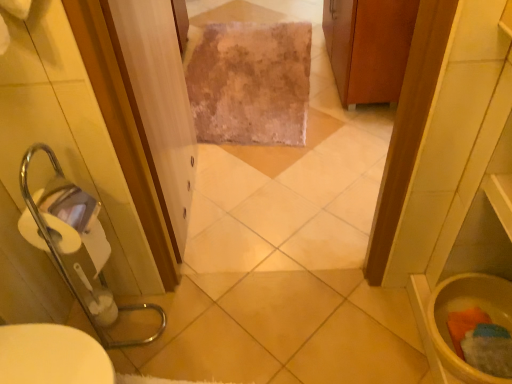
Describe the element at coordinates (464, 309) in the screenshot. I see `yellow matte toilet bowl at lower right` at that location.

Image resolution: width=512 pixels, height=384 pixels. Describe the element at coordinates (369, 47) in the screenshot. I see `wooden cabinet at upper right` at that location.

You are a GUI agent. You are given a task and a screenshot of the screen. Output one action in this format:
    pyautogui.click(x=<x>, y=<y>)
    Task: Click on the wooden cabinet at upper right
    
    Given the screenshot: What is the action you would take?
    pyautogui.click(x=369, y=47)

The width and height of the screenshot is (512, 384). I want to click on yellow matte toilet bowl at lower right, so click(x=464, y=309).

Looking at this image, can you confirm if wooden cabinet at upper right is positioned to the left of yellow matte toilet bowl at lower right?

Yes, wooden cabinet at upper right is to the left of yellow matte toilet bowl at lower right.

Considering the relative sizes of wooden cabinet at upper right and yellow matte toilet bowl at lower right in the image provided, is wooden cabinet at upper right bigger than yellow matte toilet bowl at lower right?

Yes.

Considering the sizes of wooden cabinet at upper right and yellow matte toilet bowl at lower right in the image, is wooden cabinet at upper right wider or thinner than yellow matte toilet bowl at lower right?

wooden cabinet at upper right is wider than yellow matte toilet bowl at lower right.

From the image's perspective, does wooden cabinet at upper right appear higher than yellow matte toilet bowl at lower right?

Yes, from the image's perspective, wooden cabinet at upper right is above yellow matte toilet bowl at lower right.

Considering the relative positions of yellow matte toilet bowl at lower right and clear plastic screen door at center in the image provided, is yellow matte toilet bowl at lower right behind clear plastic screen door at center?

Yes, yellow matte toilet bowl at lower right is further from the camera.

Where is `screen door above the yellow matte toilet bowl at lower right (from the image's perspective)`? This screenshot has height=384, width=512. screen door above the yellow matte toilet bowl at lower right (from the image's perspective) is located at coordinates (157, 102).

From their relative heights in the image, would you say yellow matte toilet bowl at lower right is taller or shorter than clear plastic screen door at center?

yellow matte toilet bowl at lower right is shorter than clear plastic screen door at center.

How much distance is there between yellow matte toilet bowl at lower right and clear plastic screen door at center?

3.60 feet.

Considering the sizes of fuzzy beige rug at center and clear plastic screen door at center in the image, is fuzzy beige rug at center bigger or smaller than clear plastic screen door at center?

Considering their sizes, fuzzy beige rug at center takes up less space than clear plastic screen door at center.

Considering the sizes of objects fuzzy beige rug at center and clear plastic screen door at center in the image provided, who is wider, fuzzy beige rug at center or clear plastic screen door at center?

fuzzy beige rug at center.

In the scene shown: Would you consider fuzzy beige rug at center to be distant from clear plastic screen door at center?

Actually, fuzzy beige rug at center and clear plastic screen door at center are a little close together.

From the image's perspective, is fuzzy beige rug at center below clear plastic screen door at center?

No, from the image's perspective, fuzzy beige rug at center is not beneath clear plastic screen door at center.

From the image's perspective, which one is positioned lower, clear plastic screen door at center or yellow matte toilet bowl at lower right?

yellow matte toilet bowl at lower right.

Is clear plastic screen door at center positioned beyond the bounds of yellow matte toilet bowl at lower right?

clear plastic screen door at center is positioned outside yellow matte toilet bowl at lower right.

The height and width of the screenshot is (384, 512). In order to click on toilet bowl that is below the clear plastic screen door at center (from the image's perspective) in this screenshot , I will do point(464,309).

Considering the sizes of objects clear plastic screen door at center and yellow matte toilet bowl at lower right in the image provided, who is smaller, clear plastic screen door at center or yellow matte toilet bowl at lower right?

With smaller size is yellow matte toilet bowl at lower right.

I want to click on bath towel behind the wooden cabinet at upper right, so click(251, 83).

Based on the photo, can you confirm if wooden cabinet at upper right is taller than fuzzy beige rug at center?

Indeed, wooden cabinet at upper right has a greater height compared to fuzzy beige rug at center.

Is wooden cabinet at upper right positioned far away from fuzzy beige rug at center?

No, wooden cabinet at upper right is in close proximity to fuzzy beige rug at center.

Which is more to the right, wooden cabinet at upper right or clear plastic screen door at center?

wooden cabinet at upper right is more to the right.

Find the location of a particular element. This screenshot has width=512, height=384. cabinetry that is behind the clear plastic screen door at center is located at coordinates (369, 47).

Is wooden cabinet at upper right facing towards clear plastic screen door at center?

No, wooden cabinet at upper right is not facing towards clear plastic screen door at center.

Could you tell me if fuzzy beige rug at center is facing wooden cabinet at upper right?

No, fuzzy beige rug at center is not oriented towards wooden cabinet at upper right.

Is point (206, 132) in front of point (325, 8)?

Yes, point (206, 132) is in front of point (325, 8).

Choose the correct answer: Is fuzzy beige rug at center inside wooden cabinet at upper right or outside it?

fuzzy beige rug at center is not inside wooden cabinet at upper right, it's outside.

Based on the photo, measure the distance between fuzzy beige rug at center and wooden cabinet at upper right.

19.71 inches.

This screenshot has width=512, height=384. I want to click on cabinetry above the yellow matte toilet bowl at lower right (from a real-world perspective), so click(x=369, y=47).

Find the location of a particular element. Image resolution: width=512 pixels, height=384 pixels. screen door in front of the yellow matte toilet bowl at lower right is located at coordinates (157, 102).

Considering their positions, is yellow matte toilet bowl at lower right positioned closer to wooden cabinet at upper right than clear plastic screen door at center?

Based on the image, clear plastic screen door at center appears to be nearer to wooden cabinet at upper right.

Estimate the real-world distances between objects in this image. Which object is closer to wooden cabinet at upper right, yellow matte toilet bowl at lower right or fuzzy beige rug at center?

fuzzy beige rug at center.

When comparing their distances from yellow matte toilet bowl at lower right, does fuzzy beige rug at center or wooden cabinet at upper right seem further?

Among the two, fuzzy beige rug at center is located further to yellow matte toilet bowl at lower right.

When comparing their distances from fuzzy beige rug at center, does clear plastic screen door at center or yellow matte toilet bowl at lower right seem further?

yellow matte toilet bowl at lower right is positioned further to the anchor fuzzy beige rug at center.

From the image, which object appears to be nearer to wooden cabinet at upper right, clear plastic screen door at center or yellow matte toilet bowl at lower right?

clear plastic screen door at center.

Which object lies further to the anchor point yellow matte toilet bowl at lower right, clear plastic screen door at center or wooden cabinet at upper right?

wooden cabinet at upper right.

Estimate the real-world distances between objects in this image. Which object is closer to fuzzy beige rug at center, wooden cabinet at upper right or clear plastic screen door at center?

wooden cabinet at upper right is closer to fuzzy beige rug at center.

Looking at the image, which one is located closer to clear plastic screen door at center, yellow matte toilet bowl at lower right or wooden cabinet at upper right?

wooden cabinet at upper right lies closer to clear plastic screen door at center than the other object.

You are a GUI agent. You are given a task and a screenshot of the screen. Output one action in this format:
    pyautogui.click(x=<x>, y=<y>)
    Task: Click on the bath towel between wooden cabinet at upper right and yellow matte toilet bowl at lower right from top to bottom
    The image size is (512, 384).
    Given the screenshot: What is the action you would take?
    pyautogui.click(x=251, y=83)

What are the coordinates of `screen door between wooden cabinet at upper right and yellow matte toilet bowl at lower right from top to bottom` in the screenshot? It's located at (157, 102).

Identify the location of toilet bowl between clear plastic screen door at center and fuzzy beige rug at center from front to back. The width and height of the screenshot is (512, 384). (464, 309).

I want to click on cabinetry between clear plastic screen door at center and fuzzy beige rug at center along the z-axis, so click(x=369, y=47).